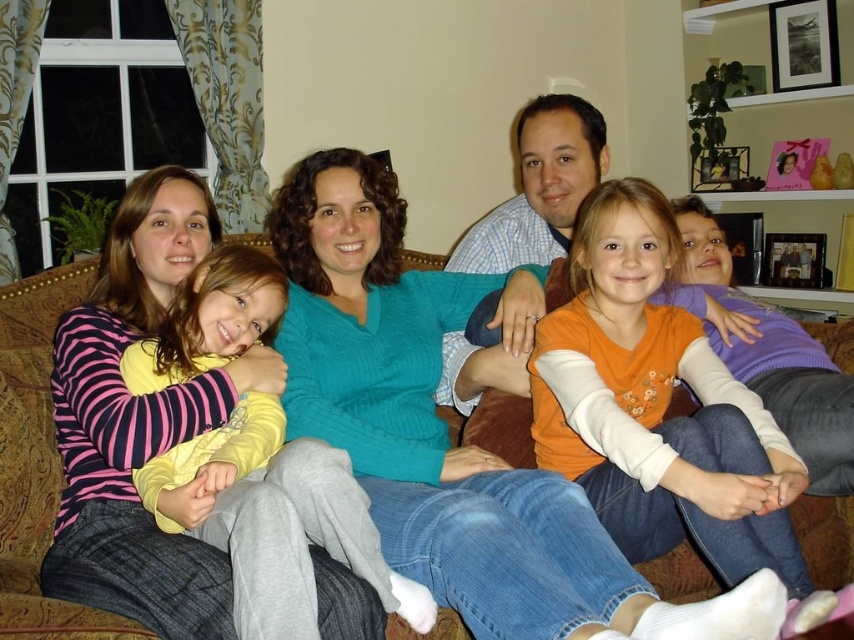
Question: Which object is the farthest from the yellow long-sleeve shirt at center?

Choices:
 (A) orange cotton shirt at center
 (B) striped fleece sweater at left

Answer: (A)

Question: Can you confirm if yellow long-sleeve shirt at center is thinner than striped fleece sweater at left?

Choices:
 (A) yes
 (B) no

Answer: (B)

Question: Does orange cotton shirt at center have a smaller size compared to yellow long-sleeve shirt at center?

Choices:
 (A) no
 (B) yes

Answer: (A)

Question: Estimate the real-world distances between objects in this image. Which object is closer to the orange cotton shirt at center?

Choices:
 (A) yellow long-sleeve shirt at center
 (B) striped fleece sweater at left

Answer: (A)

Question: Which is farther from the striped fleece sweater at left?

Choices:
 (A) yellow long-sleeve shirt at center
 (B) orange cotton shirt at center

Answer: (B)

Question: Is orange cotton shirt at center behind yellow long-sleeve shirt at center?

Choices:
 (A) yes
 (B) no

Answer: (A)